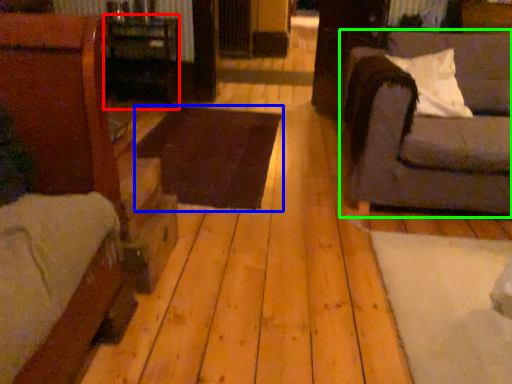
Question: Which is farther away from table (highlighted by a red box)? table (highlighted by a blue box) or studio couch (highlighted by a green box)?

Choices:
 (A) table
 (B) studio couch

Answer: (B)